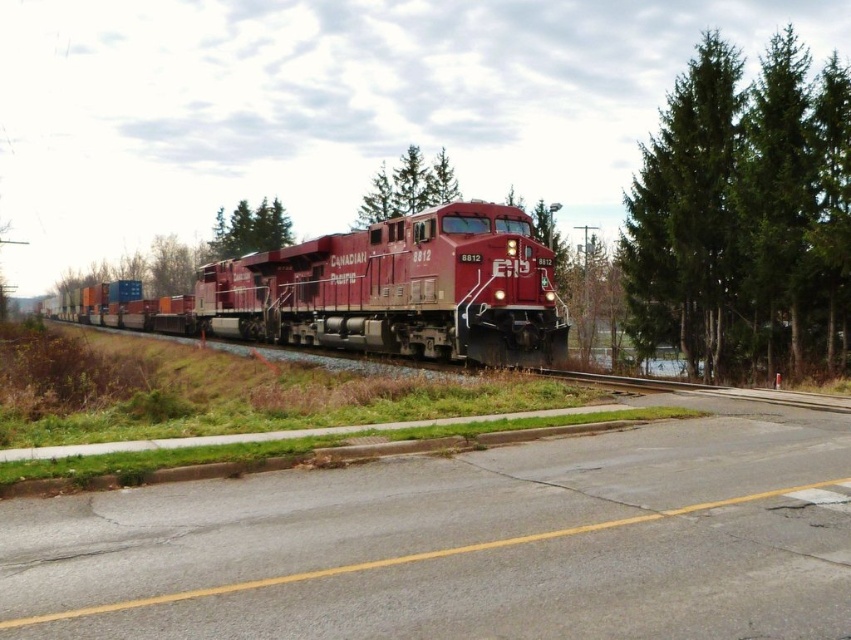
Between green textured tree at right and matte red locomotive at center, which one has less height?

matte red locomotive at center

Between green textured tree at right and matte red locomotive at center, which one is positioned higher?

Positioned higher is green textured tree at right.

Is point (734, 116) positioned behind point (353, 282)?

No, (734, 116) is closer to viewer.

The width and height of the screenshot is (851, 640). I want to click on green textured tree at right, so click(744, 214).

Between point (650, 280) and point (252, 214), which one is positioned behind?

The point (252, 214) is behind.

Which is above, green textured tree at right or green matte tree at upper left?

green textured tree at right is above.

Does point (749, 173) come closer to viewer compared to point (235, 224)?

Yes, point (749, 173) is closer to viewer.

Identify the location of green textured tree at right. (744, 214).

Can you confirm if matte red locomotive at center is positioned to the left of green textured tree at center?

Yes, matte red locomotive at center is to the left of green textured tree at center.

Who is more distant from viewer, (x=494, y=272) or (x=448, y=177)?

The point (x=448, y=177) is more distant.

The height and width of the screenshot is (640, 851). Find the location of `matte red locomotive at center`. matte red locomotive at center is located at coordinates (370, 292).